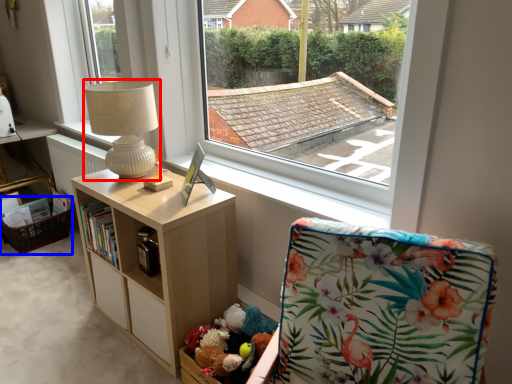
Question: Which of the following is the farthest to the observer, table lamp (highlighted by a red box) or basket (highlighted by a blue box)?

Choices:
 (A) table lamp
 (B) basket

Answer: (B)